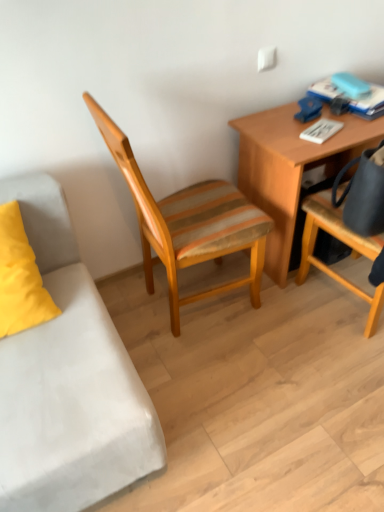
The image size is (384, 512). What do you see at coordinates (291, 168) in the screenshot?
I see `wooden desk at upper right` at bounding box center [291, 168].

This screenshot has width=384, height=512. What are the coordinates of `woodenchair at center, which is the 1th chair from left to right` in the screenshot? It's located at (188, 223).

Where is `wooden desk at upper right`? The width and height of the screenshot is (384, 512). wooden desk at upper right is located at coordinates (291, 168).

Measure the distance between matte black bag at right, the 1th chair positioned from the right, and wooden desk at upper right.

matte black bag at right, the 1th chair positioned from the right, and wooden desk at upper right are 8.87 inches apart.

Is matte black bag at right, arranged as the second chair when viewed from the left, bigger or smaller than wooden desk at upper right?

Considering their sizes, matte black bag at right, arranged as the second chair when viewed from the left, takes up more space than wooden desk at upper right.

Which object is positioned more to the left, matte black bag at right, arranged as the second chair when viewed from the left, or wooden desk at upper right?

wooden desk at upper right.

Between matte black bag at right, the 1th chair positioned from the right, and wooden desk at upper right, which one has smaller width?

Thinner between the two is wooden desk at upper right.

Is wooden desk at upper right far away from woodenchair at center, which is the second chair in right-to-left order?

Actually, wooden desk at upper right and woodenchair at center, which is the second chair in right-to-left order, are a little close together.

Could you tell me if wooden desk at upper right is turned towards woodenchair at center, which is the 1th chair from left to right?

No, wooden desk at upper right is not oriented towards woodenchair at center, which is the 1th chair from left to right.

From a real-world perspective, is wooden desk at upper right on woodenchair at center, which is the second chair in right-to-left order?

No, from a real-world perspective, wooden desk at upper right is not on top of woodenchair at center, which is the second chair in right-to-left order.

Would you say woodenchair at center, which is the 1th chair from left to right, is part of matte black bag at right, the 1th chair positioned from the right,'s contents?

Actually, woodenchair at center, which is the 1th chair from left to right, is outside matte black bag at right, the 1th chair positioned from the right.

Is point (312, 218) in front of point (152, 203)?

That is False.

Considering the positions of objects matte black bag at right, the 1th chair positioned from the right, and woodenchair at center, which is the 1th chair from left to right, in the image provided, who is behind, matte black bag at right, the 1th chair positioned from the right, or woodenchair at center, which is the 1th chair from left to right,?

woodenchair at center, which is the 1th chair from left to right, is further from the camera.

Consider the image. Considering the sizes of objects matte black bag at right, the 1th chair positioned from the right, and woodenchair at center, which is the 1th chair from left to right, in the image provided, who is bigger, matte black bag at right, the 1th chair positioned from the right, or woodenchair at center, which is the 1th chair from left to right,?

woodenchair at center, which is the 1th chair from left to right, is bigger.

Does woodenchair at center, which is the second chair in right-to-left order, turn towards matte black bag at right, arranged as the second chair when viewed from the left?

No, woodenchair at center, which is the second chair in right-to-left order, is not turned towards matte black bag at right, arranged as the second chair when viewed from the left.

From the image's perspective, would you say woodenchair at center, which is the 1th chair from left to right, is shown under matte black bag at right, arranged as the second chair when viewed from the left?

Actually, woodenchair at center, which is the 1th chair from left to right, appears above matte black bag at right, arranged as the second chair when viewed from the left, in the image.

From the picture: Which point is more forward, (167, 260) or (298, 271)?

Positioned in front is point (167, 260).

Measure the distance between woodenchair at center, which is the 1th chair from left to right, and wooden desk at upper right.

woodenchair at center, which is the 1th chair from left to right, is 30.90 centimeters away from wooden desk at upper right.

What's the angular difference between woodenchair at center, which is the second chair in right-to-left order, and wooden desk at upper right's facing directions?

The facing directions of woodenchair at center, which is the second chair in right-to-left order, and wooden desk at upper right are 88.4 degrees apart.

Would you say woodenchair at center, which is the 1th chair from left to right, contains wooden desk at upper right?

No.

Which of these two, woodenchair at center, which is the 1th chair from left to right, or wooden desk at upper right, stands taller?

woodenchair at center, which is the 1th chair from left to right, is taller.

Is wooden desk at upper right placed right next to matte black bag at right, the 1th chair positioned from the right?

No, wooden desk at upper right is not in contact with matte black bag at right, the 1th chair positioned from the right.

Considering the positions of objects wooden desk at upper right and matte black bag at right, the 1th chair positioned from the right, in the image provided, who is behind, wooden desk at upper right or matte black bag at right, the 1th chair positioned from the right,?

Positioned behind is wooden desk at upper right.

In the image, there is a matte black bag at right, arranged as the second chair when viewed from the left. In order to click on desk below it (from a real-world perspective) in this screenshot , I will do `click(291, 168)`.

Is wooden desk at upper right oriented away from matte black bag at right, the 1th chair positioned from the right?

No, matte black bag at right, the 1th chair positioned from the right, is not at the back of wooden desk at upper right.

Locate an element on the screen. the 2nd chair below when counting from the wooden desk at upper right (from the image's perspective) is located at coordinates (345, 243).

The height and width of the screenshot is (512, 384). Identify the location of desk below the woodenchair at center, which is the second chair in right-to-left order (from a real-world perspective). (291, 168).

When comparing their distances from wooden desk at upper right, does matte black bag at right, arranged as the second chair when viewed from the left, or woodenchair at center, which is the second chair in right-to-left order, seem closer?

matte black bag at right, arranged as the second chair when viewed from the left, is positioned closer to the anchor wooden desk at upper right.

Looking at the image, which one is located closer to woodenchair at center, which is the 1th chair from left to right, matte black bag at right, arranged as the second chair when viewed from the left, or wooden desk at upper right?

Based on the image, wooden desk at upper right appears to be nearer to woodenchair at center, which is the 1th chair from left to right.

From the image, which object appears to be farther from matte black bag at right, arranged as the second chair when viewed from the left, woodenchair at center, which is the second chair in right-to-left order, or wooden desk at upper right?

woodenchair at center, which is the second chair in right-to-left order, lies further to matte black bag at right, arranged as the second chair when viewed from the left, than the other object.

Looking at the image, which one is located closer to woodenchair at center, which is the 1th chair from left to right, wooden desk at upper right or matte black bag at right, arranged as the second chair when viewed from the left?

wooden desk at upper right lies closer to woodenchair at center, which is the 1th chair from left to right, than the other object.

When comparing their distances from matte black bag at right, the 1th chair positioned from the right, does wooden desk at upper right or woodenchair at center, which is the second chair in right-to-left order, seem further?

woodenchair at center, which is the second chair in right-to-left order.

Which object lies further to the anchor point wooden desk at upper right, woodenchair at center, which is the second chair in right-to-left order, or matte black bag at right, arranged as the second chair when viewed from the left?

The object further to wooden desk at upper right is woodenchair at center, which is the second chair in right-to-left order.

Identify the location of desk between woodenchair at center, which is the second chair in right-to-left order, and matte black bag at right, arranged as the second chair when viewed from the left. The image size is (384, 512). (291, 168).